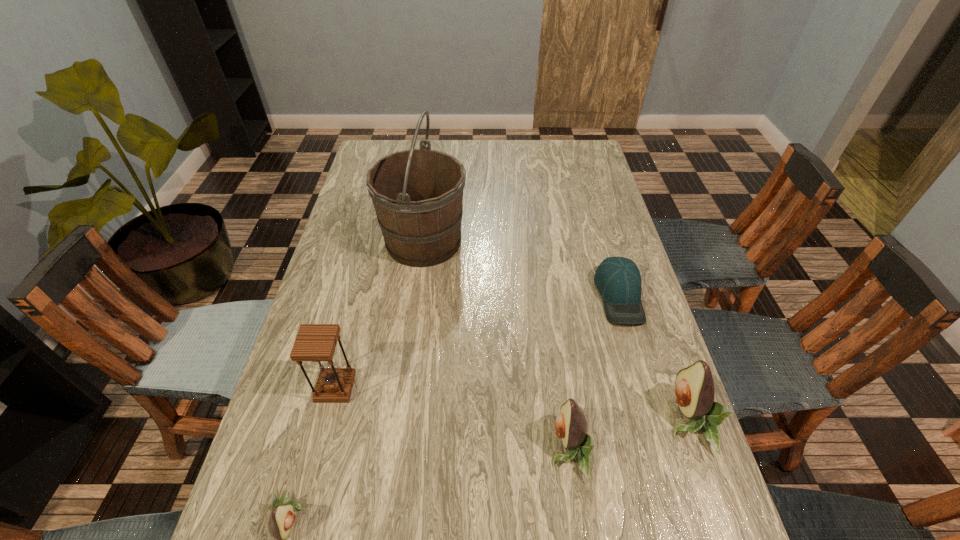
Image resolution: width=960 pixels, height=540 pixels. Find the location of `the second avocado from right to left`. the second avocado from right to left is located at coordinates point(571,426).

The width and height of the screenshot is (960, 540). Find the location of `the fourth object from left to right`. the fourth object from left to right is located at coordinates (571, 426).

Where is `the rightmost avocado`? The width and height of the screenshot is (960, 540). the rightmost avocado is located at coordinates (694, 388).

The width and height of the screenshot is (960, 540). Find the location of `bucket`. bucket is located at coordinates (417, 194).

Find the location of `the shortest object`. the shortest object is located at coordinates (618, 279).

Where is `hourglass`? hourglass is located at coordinates (314, 342).

Locate an element on the screen. vacant region located 0.350m on the seed side of the second tallest avocado is located at coordinates (385, 449).

The width and height of the screenshot is (960, 540). I want to click on free region located on the seed side of the second tallest avocado, so click(395, 449).

Locate an element on the screen. The image size is (960, 540). free space located 0.110m on the seed side of the second tallest avocado is located at coordinates (498, 449).

This screenshot has width=960, height=540. In order to click on free space located 0.390m on the seed side of the rightmost avocado in this screenshot , I will do `click(492, 420)`.